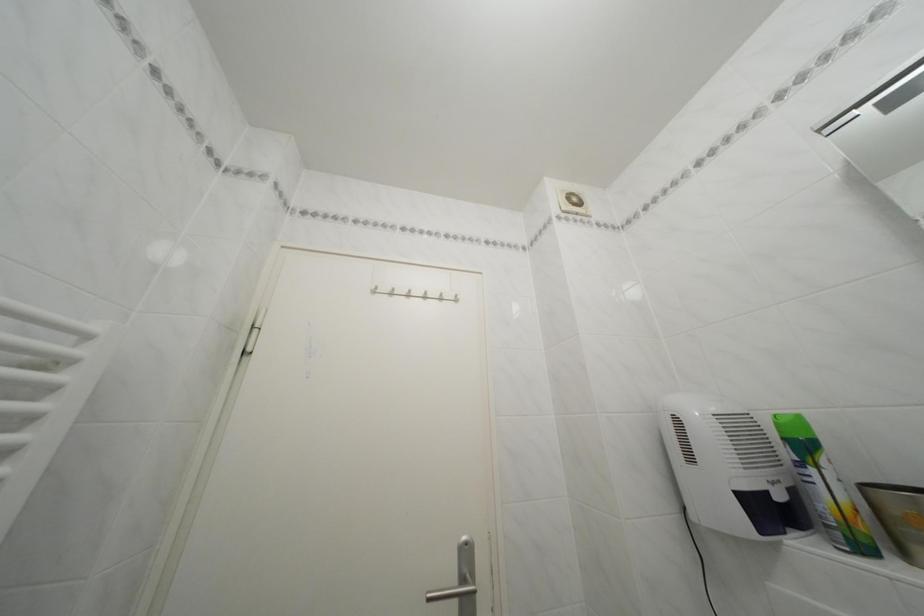
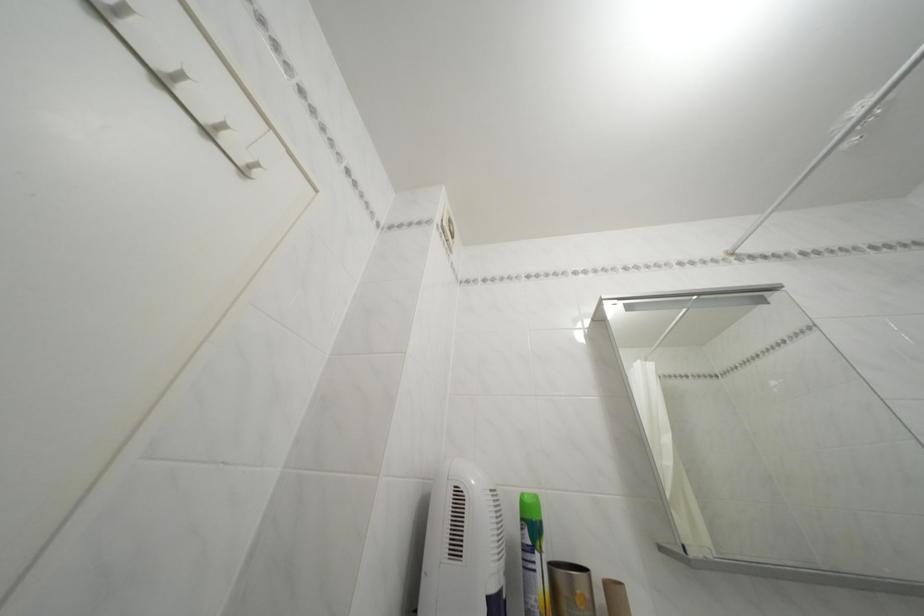
Find the pixel in the second image that matches pixel 450 305 in the first image.

(216, 139)